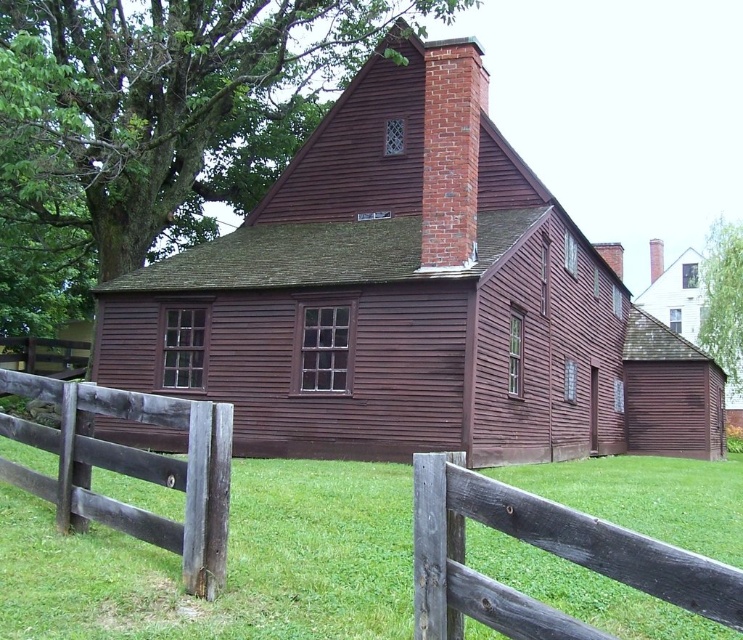
You are standing in front of the colonial house and notice the weathered wood fence at lower left and the brick chimney at upper center. Which of these two objects takes up more space in the image?

The brick chimney at upper center takes up more space in the image than the weathered wood fence at lower left.

You are standing at the entrance of the house and want to walk straight ahead towards the matte wooden barn at center. What direction should you walk in relative to the house?

Since the matte wooden barn at center is positioned at point (389, 291), you should walk straight ahead from the house entrance towards the matte wooden barn at center as it is centrally located in front of the house.

You are standing in front of the colonial house and notice the matte wooden barn at center and the brick chimney at upper center. From your perspective, which object is positioned more to the left?

The matte wooden barn at center is positioned more to the left than the brick chimney at upper center.